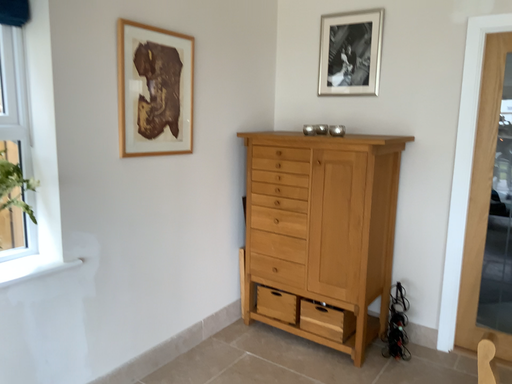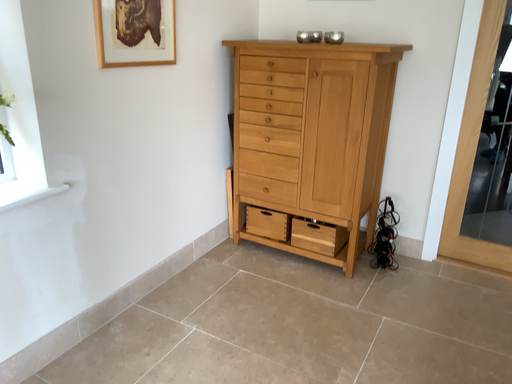
Question: Which way did the camera rotate in the video?

Choices:
 (A) rotated downward
 (B) rotated upward

Answer: (A)